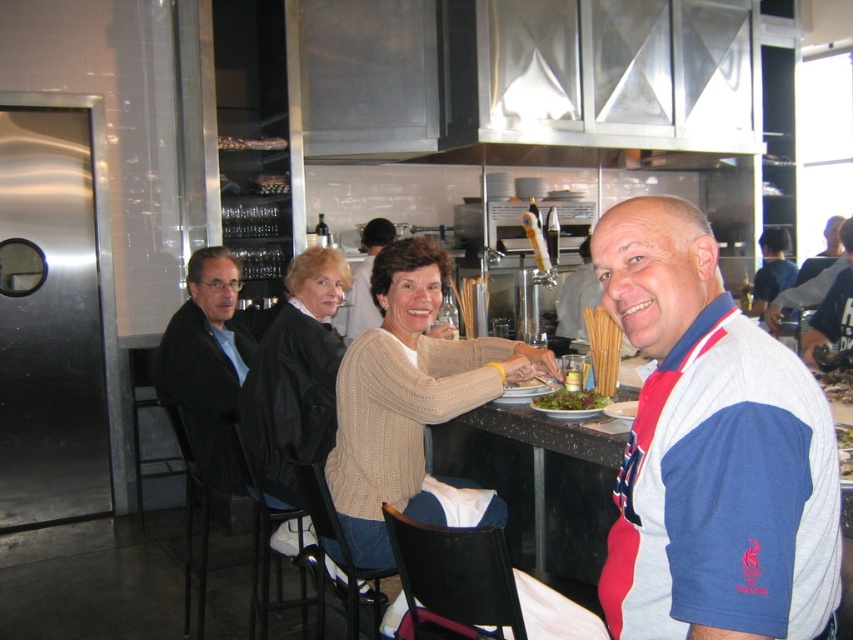
Question: Considering the real-world distances, which object is farthest from the green leafy salad at center?

Choices:
 (A) matte black sweater at center
 (B) blue and white polo shirt at right
 (C) black wool jacket at left
 (D) beige knitted sweater at center

Answer: (A)

Question: Does matte black sweater at center come in front of green leafy salad at center?

Choices:
 (A) no
 (B) yes

Answer: (A)

Question: Among these points, which one is farthest from the camera?

Choices:
 (A) (375, 234)
 (B) (267, 497)
 (C) (548, 394)
 (D) (682, 525)

Answer: (A)

Question: Which object is positioned farthest from the blue cotton shirt at upper right?

Choices:
 (A) creamy knit sweater at center
 (B) green leafy salad at center
 (C) black wool jacket at left
 (D) beige knitted sweater at center

Answer: (A)

Question: Is creamy knit sweater at center above black wool jacket at left?

Choices:
 (A) no
 (B) yes

Answer: (A)

Question: Does white/red/blue fabric at right have a smaller size compared to green leafy salad at center?

Choices:
 (A) yes
 (B) no

Answer: (B)